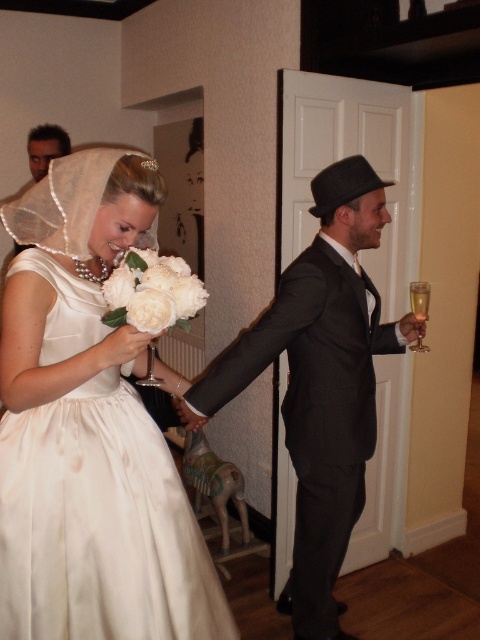
Which is more to the right, shiny black suit at center or white silk bouquet at center?

From the viewer's perspective, shiny black suit at center appears more on the right side.

Can you confirm if shiny black suit at center is positioned above white silk bouquet at center?

No.

Which is in front, point (328, 552) or point (146, 260)?

Point (146, 260) is more forward.

The height and width of the screenshot is (640, 480). I want to click on shiny black suit at center, so click(320, 381).

Which is behind, point (91, 195) or point (172, 291)?

The point (91, 195) is behind.

From the picture: Is satin dress at left thinner than white silk bouquet at center?

No, satin dress at left is not thinner than white silk bouquet at center.

Who is more distant from viewer, (156,492) or (129,276)?

Positioned behind is point (156,492).

You are a GUI agent. You are given a task and a screenshot of the screen. Output one action in this format:
    pyautogui.click(x=<x>, y=<y>)
    Task: Click on the satin dress at left
    Image resolution: width=480 pixels, height=640 pixels.
    Given the screenshot: What is the action you would take?
    pyautogui.click(x=88, y=429)

Can you confirm if satin dress at left is positioned to the right of shiny black suit at center?

In fact, satin dress at left is to the left of shiny black suit at center.

Does satin dress at left have a smaller size compared to shiny black suit at center?

Yes.

This screenshot has height=640, width=480. What do you see at coordinates (88, 429) in the screenshot?
I see `satin dress at left` at bounding box center [88, 429].

Where is `satin dress at left`? satin dress at left is located at coordinates (x=88, y=429).